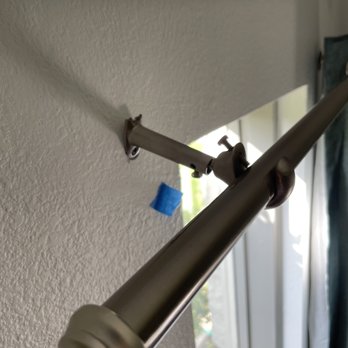
You are a GUI agent. You are given a task and a screenshot of the screen. Output one action in this format:
    pyautogui.click(x=<x>, y=<y>)
    Task: Click on the bright light
    Image resolution: width=348 pixels, height=348 pixels.
    Given the screenshot: What is the action you would take?
    pyautogui.click(x=188, y=183)